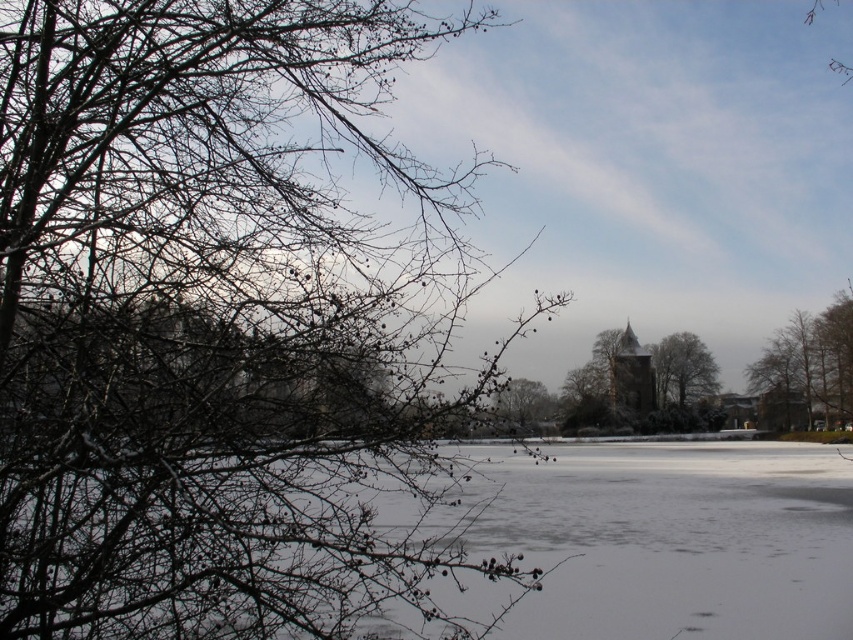
Question: Is snow-covered branches at left thinner than smooth brown tree at center?

Choices:
 (A) no
 (B) yes

Answer: (A)

Question: Does green leafy tree at right appear on the right side of smooth gray tree at center?

Choices:
 (A) yes
 (B) no

Answer: (A)

Question: Which of the following is the closest to the observer?

Choices:
 (A) (653, 349)
 (B) (505, 400)
 (C) (761, 388)
 (D) (398, 280)

Answer: (D)

Question: Which of the following is the farthest from the observer?

Choices:
 (A) (502, 392)
 (B) (54, 376)

Answer: (A)

Question: Among these points, which one is nearest to the camera?

Choices:
 (A) (198, 342)
 (B) (498, 403)

Answer: (A)

Question: Does smooth gray tree at center appear on the right side of smooth brown tree at center?

Choices:
 (A) yes
 (B) no

Answer: (A)